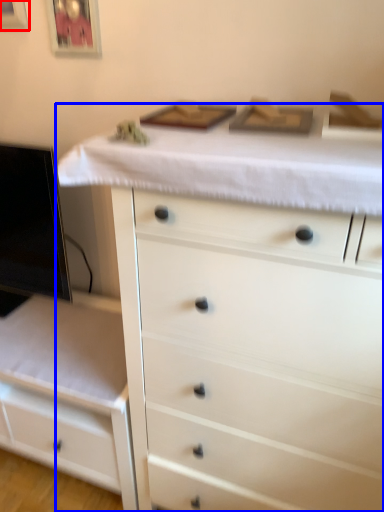
Question: Among these objects, which one is farthest to the camera, picture frame (highlighted by a red box) or chest of drawers (highlighted by a blue box)?

Choices:
 (A) picture frame
 (B) chest of drawers

Answer: (A)